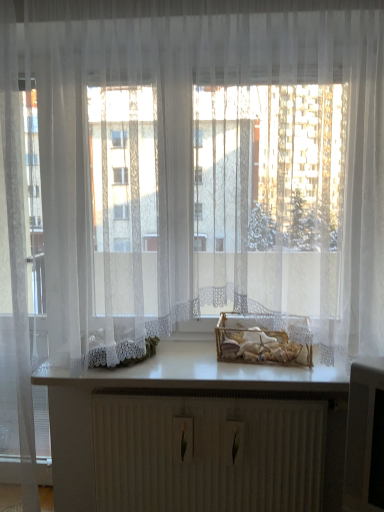
Question: From the image's perspective, is translucent glass basket at center positioned above or below transparent glass door at left?

Choices:
 (A) below
 (B) above

Answer: (A)

Question: Considering the positions of point (248, 354) and point (18, 105), is point (248, 354) closer or farther from the camera than point (18, 105)?

Choices:
 (A) farther
 (B) closer

Answer: (A)

Question: Which object is positioned closest to the white matte counter top at center?

Choices:
 (A) white textured radiator at center
 (B) translucent glass basket at center
 (C) transparent glass door at left

Answer: (B)

Question: Considering the real-world distances, which object is farthest from the white matte counter top at center?

Choices:
 (A) transparent glass door at left
 (B) white textured radiator at center
 (C) translucent glass basket at center

Answer: (A)